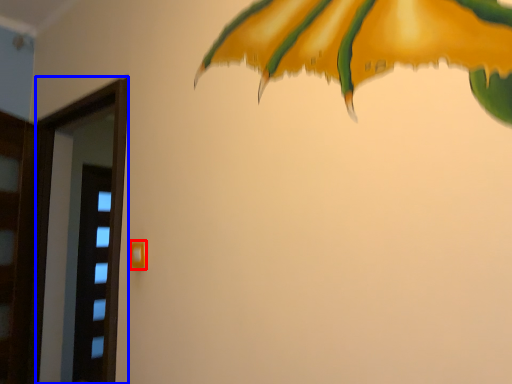
Question: Among these objects, which one is farthest to the camera, door handle (highlighted by a red box) or screen door (highlighted by a blue box)?

Choices:
 (A) door handle
 (B) screen door

Answer: (B)